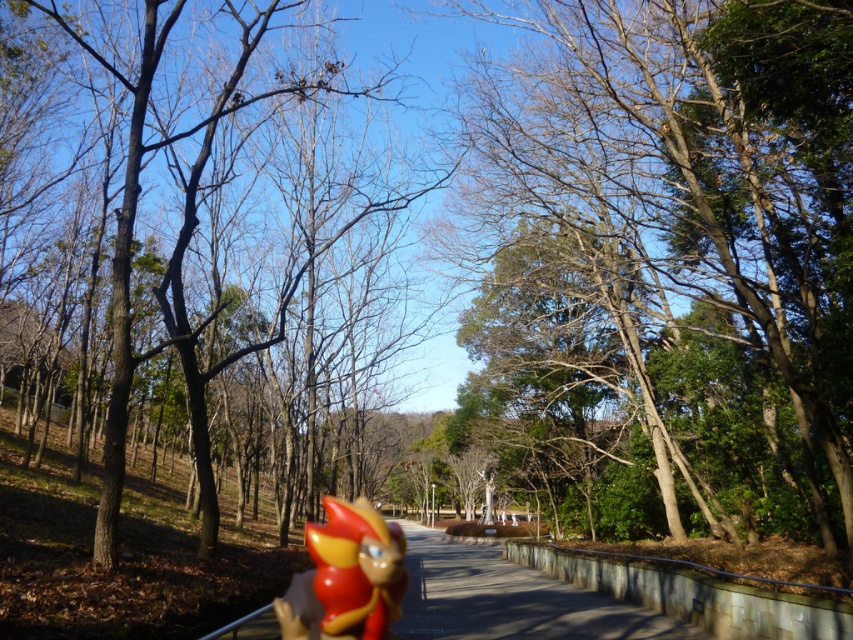
Question: Which of the following is the farthest from the observer?

Choices:
 (A) glossy plastic toy at center
 (B) brown bark tree at center
 (C) smooth bark tree at center

Answer: (C)

Question: Which object appears farthest from the camera in this image?

Choices:
 (A) glossy plastic toy at center
 (B) brown bark tree at center

Answer: (A)

Question: Which of the following is the farthest from the observer?

Choices:
 (A) glossy plastic toy at center
 (B) smooth bark tree at center

Answer: (B)

Question: Where is smooth bark tree at center located in relation to glossy plastic toy at center in the image?

Choices:
 (A) below
 (B) above

Answer: (B)

Question: Where is brown bark tree at center located in relation to glossy plastic toy at center in the image?

Choices:
 (A) left
 (B) right

Answer: (A)

Question: Is brown bark tree at center further to camera compared to glossy plastic toy at center?

Choices:
 (A) yes
 (B) no

Answer: (B)